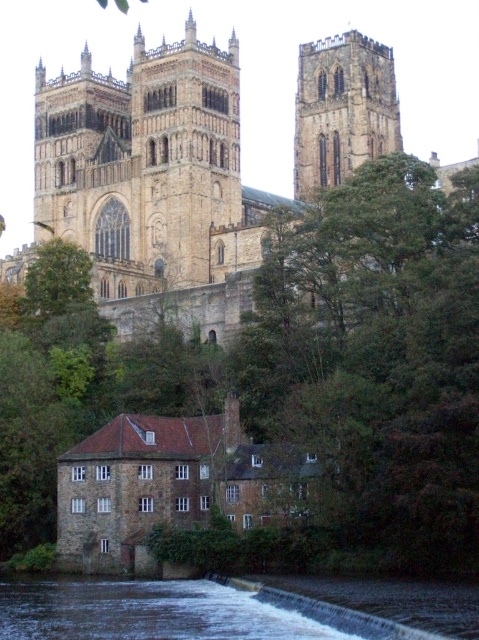
You are standing at the base of the hill where the cathedral is located. You see a green leafy tree at center and a dark gray concrete river at lower center. Which object is higher in elevation?

The green leafy tree at center is located above the dark gray concrete river at lower center, so it is higher in elevation.